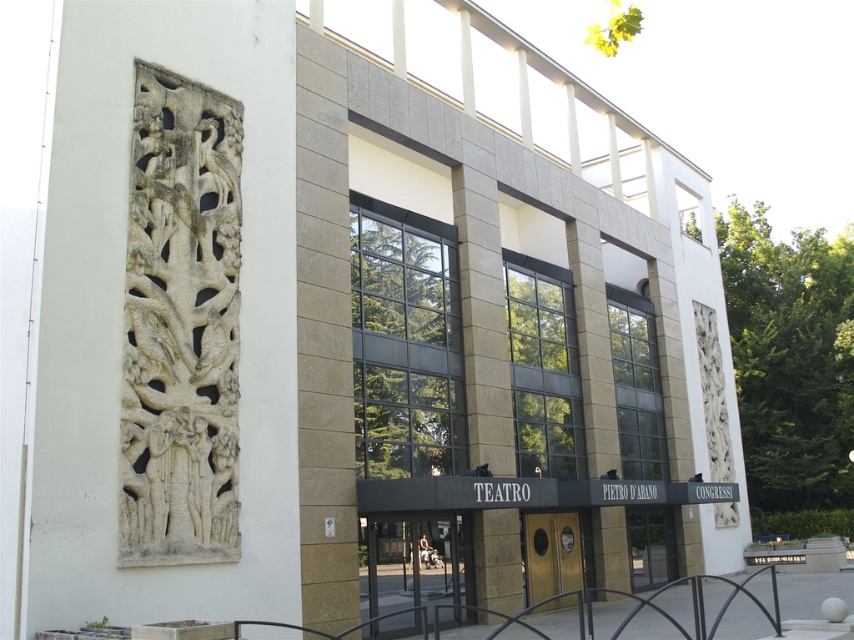
Question: Is white stone carving at left below green leafy tree at center?

Choices:
 (A) yes
 (B) no

Answer: (B)

Question: Can you confirm if green leafy tree at center is wider than gold metallic door at center?

Choices:
 (A) no
 (B) yes

Answer: (B)

Question: Does green leafy tree at center appear over gold metallic door at center?

Choices:
 (A) no
 (B) yes

Answer: (B)

Question: Which point is closer to the camera?

Choices:
 (A) (94, 240)
 (B) (566, 541)

Answer: (A)

Question: Which of the following is the farthest from the observer?

Choices:
 (A) (373, 465)
 (B) (559, 532)
 (C) (851, 273)

Answer: (C)

Question: Which of the following is the farthest from the observer?

Choices:
 (A) green leafy tree at center
 (B) green leafy tree at right

Answer: (B)